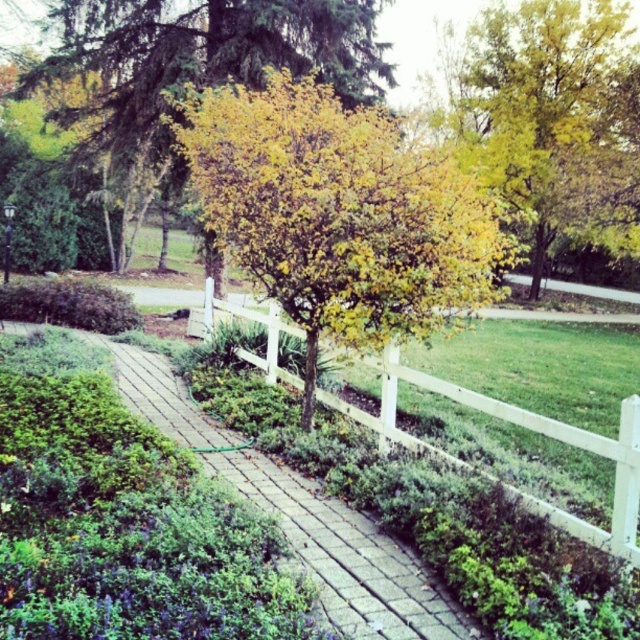
Question: Does yellow-green foliage at center have a larger size compared to yellow-green foliage at upper center?

Choices:
 (A) yes
 (B) no

Answer: (B)

Question: Which object is the farthest from the yellow-green foliage at upper center?

Choices:
 (A) white wooden fence at center
 (B) yellow-green foliage at center
 (C) brick paved path at center
 (D) yellow-green leaves at upper right

Answer: (D)

Question: Among these points, which one is nearest to the camera?

Choices:
 (A) (596, 536)
 (B) (131, 116)
 (C) (273, 200)

Answer: (A)

Question: Considering the relative positions of yellow-green foliage at center and brick paved path at center in the image provided, where is yellow-green foliage at center located with respect to brick paved path at center?

Choices:
 (A) right
 (B) left

Answer: (B)

Question: Among these points, which one is nearest to the camera?

Choices:
 (A) (268, 28)
 (B) (394, 372)

Answer: (B)

Question: Is yellow-green foliage at upper center to the right of yellow-green leaves at upper right from the viewer's perspective?

Choices:
 (A) no
 (B) yes

Answer: (A)